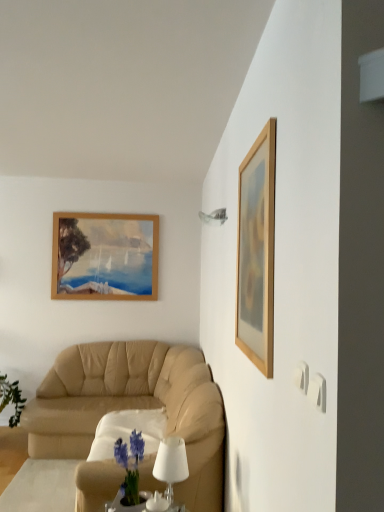
Question: From a real-world perspective, is metallic glass lampshade at upper center physically located above or below wooden picture frame at upper right?

Choices:
 (A) above
 (B) below

Answer: (A)

Question: Does point (226, 219) appear closer or farther from the camera than point (264, 271)?

Choices:
 (A) farther
 (B) closer

Answer: (A)

Question: Based on their relative distances, which object is farther from the metallic glass lampshade at upper center?

Choices:
 (A) wooden picture frame at upper right
 (B) beige leather couch at lower left
 (C) white matte table lamp at lower center

Answer: (B)

Question: Which is farther from the beige leather couch at lower left?

Choices:
 (A) white matte table lamp at lower center
 (B) wooden picture frame at upper right
 (C) metallic glass lampshade at upper center

Answer: (B)